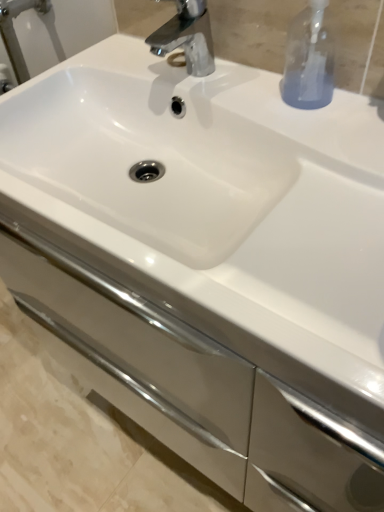
The height and width of the screenshot is (512, 384). What are the coordinates of `vacant space to the left of transparent glass soap dispenser at upper right` in the screenshot? It's located at (234, 98).